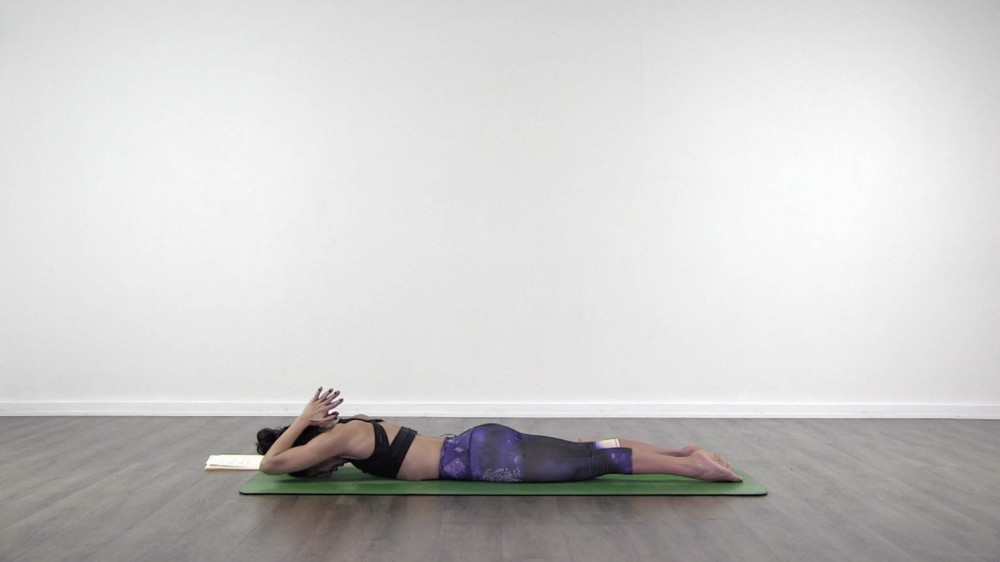
Locate an element on the screen. The image size is (1000, 562). mat is located at coordinates (349, 500).